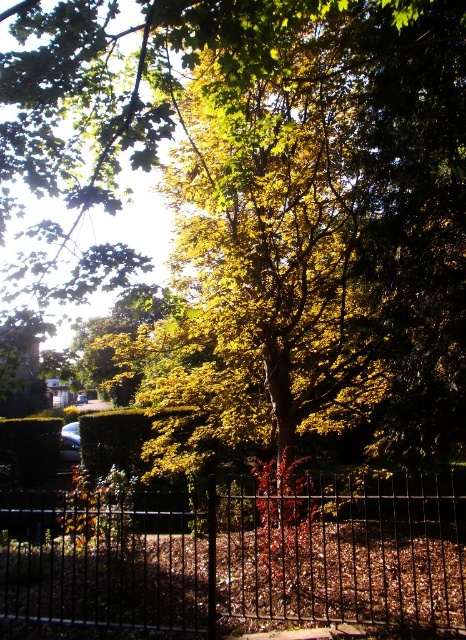
You are standing in front of the scene and want to place a small garden ornament exactly at the center of the image. Given the black metal fence at lower center, can you determine if the ornament will be placed above or below the fence?

The black metal fence at lower center is located at point coordinates of 0.869 on the x axis and 0.524 on the y axis. Since the center of the image is at point coordinates of 0.5 on both axes, the ornament placed at the center would be above the fence because the fence is positioned lower in the image.

You are designing a garden layout and need to know the spatial relationship between the black metal fence at lower center and the green leafy hedge at lower left. Which one is wider?

The black metal fence at lower center might be wider than green leafy hedge at lower left.

You are standing in the garden looking at the scene. There is a point marked at coordinates (244, 556). Which object does this point correspond to?

The point at coordinates (244, 556) corresponds to the black metal fence at lower center.